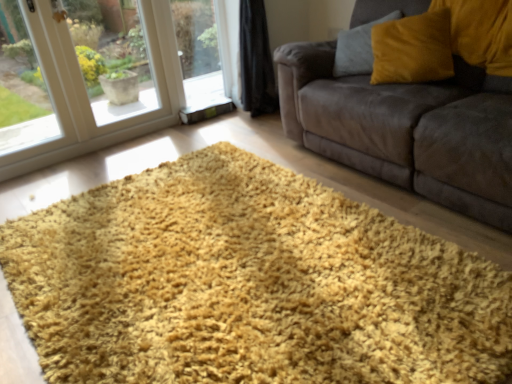
Question: Is transparent glass window at lower left placed right next to velvet yellow pillow at upper right?

Choices:
 (A) yes
 (B) no

Answer: (B)

Question: Considering the relative sizes of transparent glass window at lower left and velvet yellow pillow at upper right in the image provided, is transparent glass window at lower left smaller than velvet yellow pillow at upper right?

Choices:
 (A) yes
 (B) no

Answer: (B)

Question: Considering the relative positions of transparent glass window at lower left and velvet yellow pillow at upper right in the image provided, is transparent glass window at lower left to the left of velvet yellow pillow at upper right from the viewer's perspective?

Choices:
 (A) yes
 (B) no

Answer: (A)

Question: Can you confirm if transparent glass window at lower left is bigger than velvet yellow pillow at upper right?

Choices:
 (A) yes
 (B) no

Answer: (A)

Question: Is transparent glass window at lower left not close to velvet yellow pillow at upper right?

Choices:
 (A) yes
 (B) no

Answer: (A)

Question: Is transparent glass window at lower left thinner than velvet yellow pillow at upper right?

Choices:
 (A) no
 (B) yes

Answer: (B)

Question: Is yellow shaggy rug at center shorter than velvet yellow pillow at upper right?

Choices:
 (A) no
 (B) yes

Answer: (B)

Question: Does yellow shaggy rug at center have a smaller size compared to velvet yellow pillow at upper right?

Choices:
 (A) no
 (B) yes

Answer: (A)

Question: Is yellow shaggy rug at center aimed at velvet yellow pillow at upper right?

Choices:
 (A) yes
 (B) no

Answer: (B)

Question: Does yellow shaggy rug at center have a larger size compared to velvet yellow pillow at upper right?

Choices:
 (A) yes
 (B) no

Answer: (A)

Question: From a real-world perspective, does yellow shaggy rug at center stand above velvet yellow pillow at upper right?

Choices:
 (A) no
 (B) yes

Answer: (A)

Question: Is the position of yellow shaggy rug at center more distant than that of velvet yellow pillow at upper right?

Choices:
 (A) yes
 (B) no

Answer: (B)

Question: Does velvet brown couch at center have a lesser height compared to velvet yellow pillow at upper right?

Choices:
 (A) no
 (B) yes

Answer: (A)